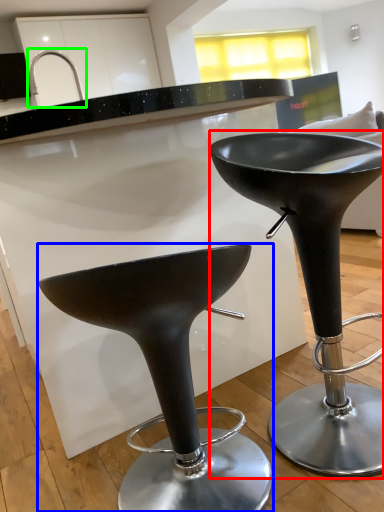
Question: Considering the real-world distances, which object is closest to stool (highlighted by a red box)? stool (highlighted by a blue box) or faucet (highlighted by a green box).

Choices:
 (A) stool
 (B) faucet

Answer: (A)